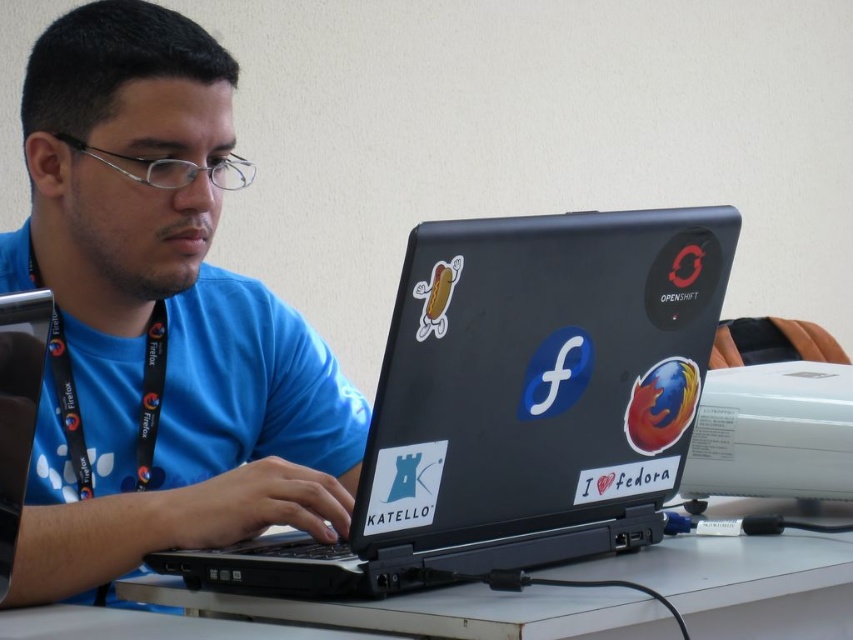
Can you confirm if blue fabric shirt at center is positioned to the left of white plastic table at center?

Yes, blue fabric shirt at center is to the left of white plastic table at center.

Does blue fabric shirt at center have a larger size compared to white plastic table at center?

Indeed, blue fabric shirt at center has a larger size compared to white plastic table at center.

Looking at this image, who is more distant from viewer, (54, 474) or (752, 595)?

Point (54, 474)

You are a GUI agent. You are given a task and a screenshot of the screen. Output one action in this format:
    pyautogui.click(x=<x>, y=<y>)
    Task: Click on the blue fabric shirt at center
    Image resolution: width=853 pixels, height=640 pixels.
    Given the screenshot: What is the action you would take?
    pyautogui.click(x=157, y=317)

Is blue fabric shirt at center thinner than black fabric lanyard at left?

No.

Between point (305, 508) and point (161, 353), which one is positioned in front?

Point (305, 508)

Which is in front, point (57, 147) or point (154, 360)?

Point (57, 147) is more forward.

The height and width of the screenshot is (640, 853). In order to click on blue fabric shirt at center in this screenshot , I will do `click(157, 317)`.

Identify the location of black matte laptop at center. coord(515,403).

Which is below, black matte laptop at center or white plastic table at center?

Positioned lower is white plastic table at center.

The image size is (853, 640). I want to click on black matte laptop at center, so click(515, 403).